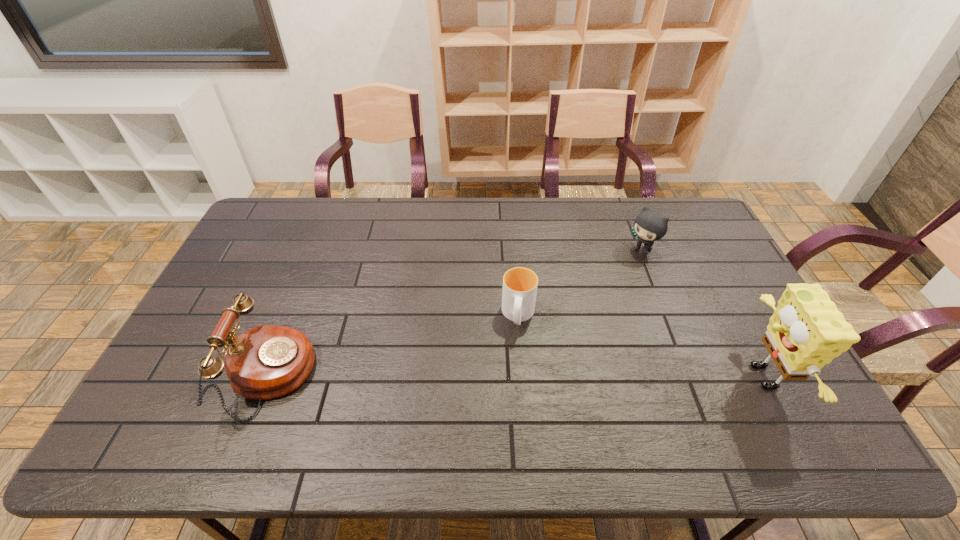
Identify the location of free spot on the desktop that is between the second tallest object and the tallest object and is positioned with the handle on the side of the shortest object. click(x=512, y=376).

Locate an element on the screen. Image resolution: width=960 pixels, height=540 pixels. vacant space on the desktop that is between the telephone and the sponge and is positioned on the front-facing side of the kitten is located at coordinates (473, 376).